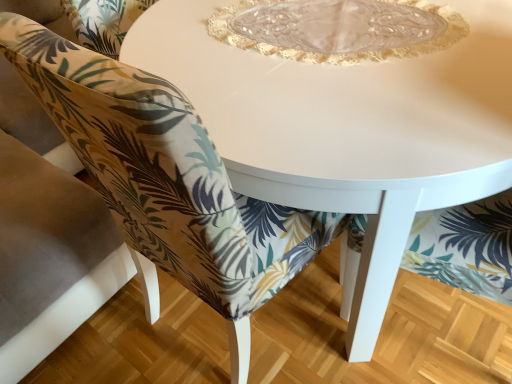
Question: Does printed fabric chair at center have a lesser width compared to transparent glass plate at center?

Choices:
 (A) no
 (B) yes

Answer: (A)

Question: Does printed fabric chair at center have a lesser height compared to transparent glass plate at center?

Choices:
 (A) no
 (B) yes

Answer: (A)

Question: Can you confirm if printed fabric chair at center is positioned to the left of transparent glass plate at center?

Choices:
 (A) yes
 (B) no

Answer: (A)

Question: Would you say printed fabric chair at center is a long distance from transparent glass plate at center?

Choices:
 (A) no
 (B) yes

Answer: (A)

Question: Considering the relative positions of printed fabric chair at center and transparent glass plate at center in the image provided, is printed fabric chair at center to the right of transparent glass plate at center from the viewer's perspective?

Choices:
 (A) yes
 (B) no

Answer: (B)

Question: Is transparent glass plate at center surrounded by printed fabric chair at center?

Choices:
 (A) no
 (B) yes

Answer: (A)

Question: Is white glossy table at center thinner than printed fabric chair at center?

Choices:
 (A) yes
 (B) no

Answer: (A)

Question: Considering the relative positions of white glossy table at center and printed fabric chair at center in the image provided, is white glossy table at center to the right of printed fabric chair at center from the viewer's perspective?

Choices:
 (A) no
 (B) yes

Answer: (B)

Question: Is white glossy table at center not within printed fabric chair at center?

Choices:
 (A) no
 (B) yes

Answer: (B)

Question: Is white glossy table at center smaller than printed fabric chair at center?

Choices:
 (A) yes
 (B) no

Answer: (A)

Question: From a real-world perspective, is white glossy table at center positioned over printed fabric chair at center based on gravity?

Choices:
 (A) yes
 (B) no

Answer: (B)

Question: From a real-world perspective, does white glossy table at center sit lower than printed fabric chair at center?

Choices:
 (A) yes
 (B) no

Answer: (A)

Question: Is printed fabric chair at center smaller than white glossy table at center?

Choices:
 (A) yes
 (B) no

Answer: (B)